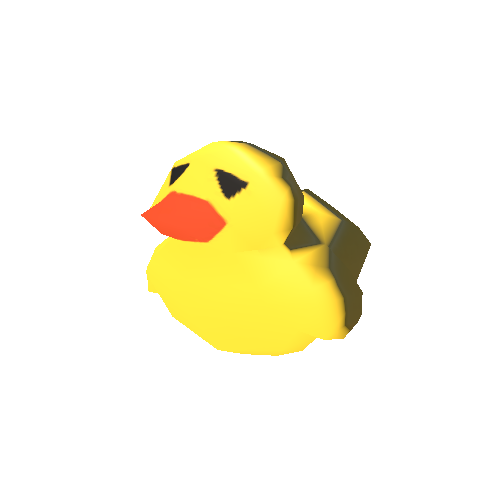
Where is `chest`? This screenshot has width=500, height=500. chest is located at coordinates (201, 310).